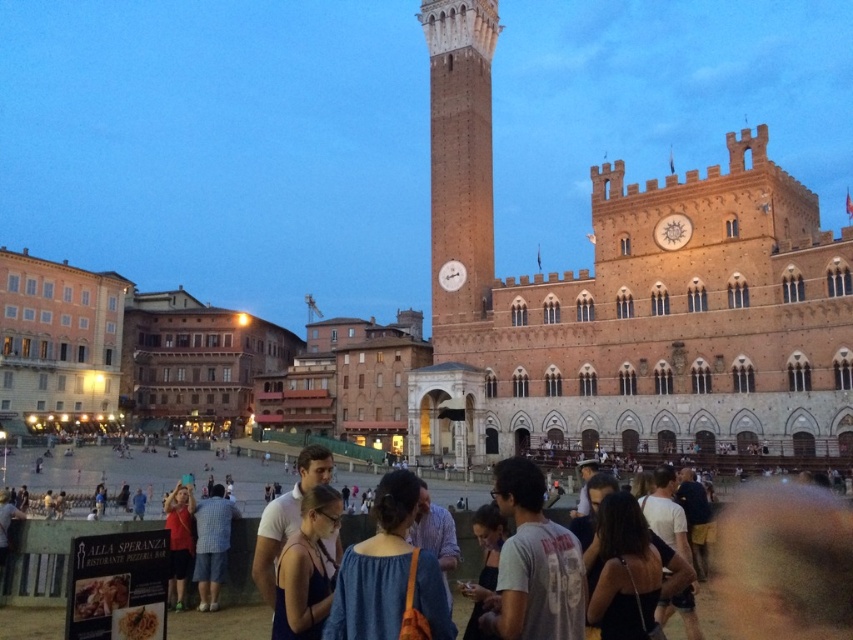
Question: Considering the real-world distances, which object is closest to the dark blue fabric crowd at lower center?

Choices:
 (A) brick clock tower at center
 (B) brown stone tower at center
 (C) gray cotton t-shirt at center

Answer: (C)

Question: Can you confirm if brown stone tower at center is bigger than gray cotton t-shirt at center?

Choices:
 (A) yes
 (B) no

Answer: (A)

Question: Which object appears farthest from the camera in this image?

Choices:
 (A) gray cotton t-shirt at center
 (B) dark blue fabric crowd at lower center

Answer: (B)

Question: Is brown stone tower at center below dark blue fabric crowd at lower center?

Choices:
 (A) no
 (B) yes

Answer: (A)

Question: Which object is the farthest from the brick clock tower at center?

Choices:
 (A) dark blue fabric crowd at lower center
 (B) brown stone tower at center

Answer: (A)

Question: Does brown stone tower at center have a smaller size compared to gray cotton t-shirt at center?

Choices:
 (A) no
 (B) yes

Answer: (A)